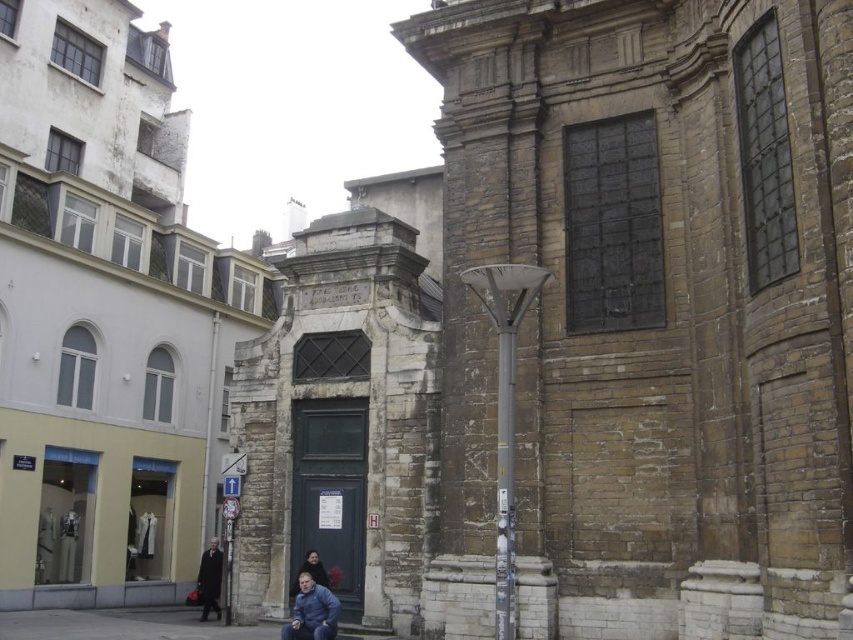
Consider the image. Does dark brown leather coat at lower left appear under dark brown leather jacket at lower center?

Yes.

Who is more distant from viewer, (x=212, y=600) or (x=328, y=582)?

The point (x=212, y=600) is behind.

Locate an element on the screen. dark brown leather coat at lower left is located at coordinates (209, 579).

Which is behind, point (296, 616) or point (311, 564)?

The point (311, 564) is behind.

Based on the photo, is blue denim jacket at lower center above dark brown leather jacket at lower center?

Yes, blue denim jacket at lower center is above dark brown leather jacket at lower center.

The width and height of the screenshot is (853, 640). What do you see at coordinates (311, 611) in the screenshot? I see `blue denim jacket at lower center` at bounding box center [311, 611].

Where is `blue denim jacket at lower center`? blue denim jacket at lower center is located at coordinates (311, 611).

Can you confirm if gray concrete pavement at lower center is shorter than dark brown leather coat at lower left?

In fact, gray concrete pavement at lower center may be taller than dark brown leather coat at lower left.

Which is more to the left, gray concrete pavement at lower center or dark brown leather coat at lower left?

dark brown leather coat at lower left

Is point (178, 618) positioned in front of point (199, 573)?

Yes.

The height and width of the screenshot is (640, 853). In order to click on gray concrete pavement at lower center in this screenshot , I will do `click(123, 625)`.